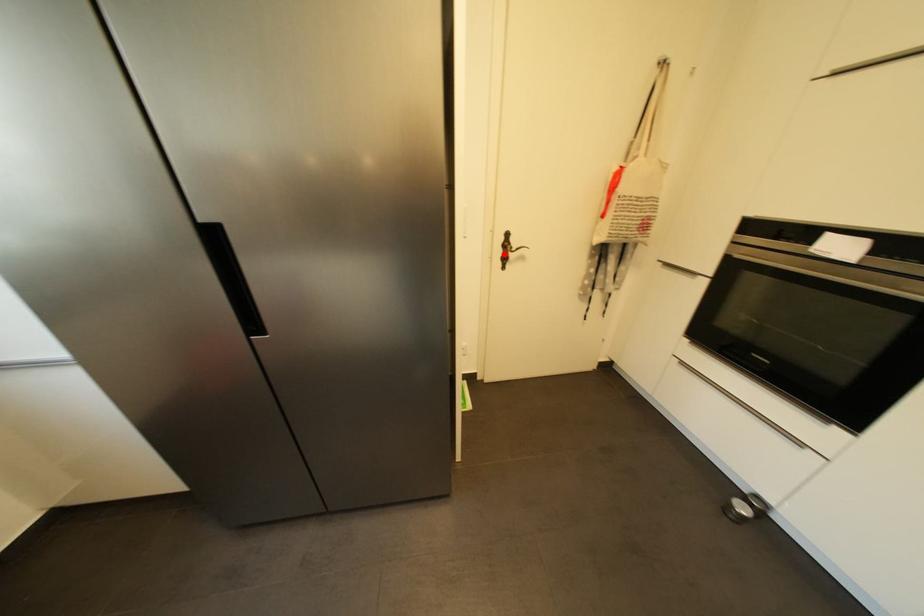
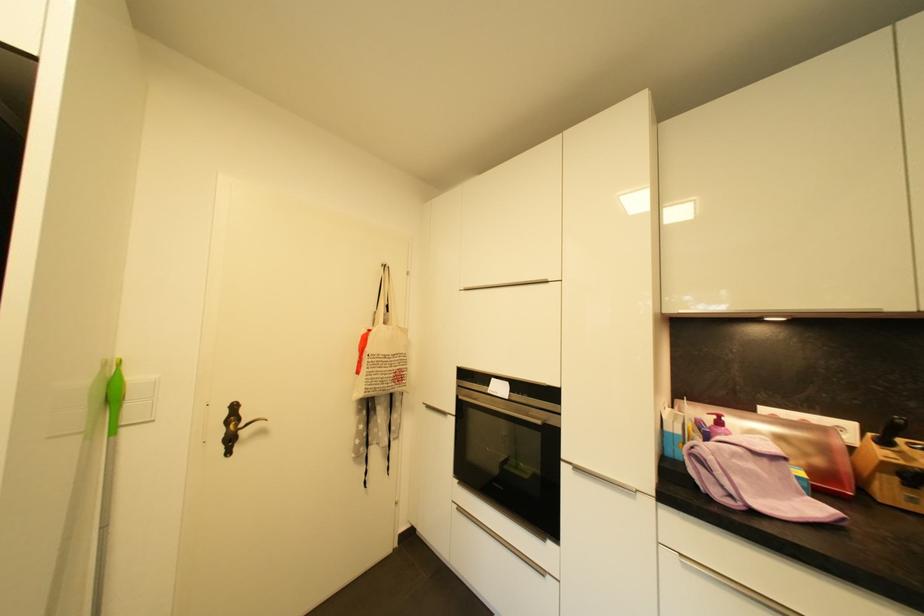
Find the pixel in the second image that matches the highlighted location in the first image.

(225, 434)